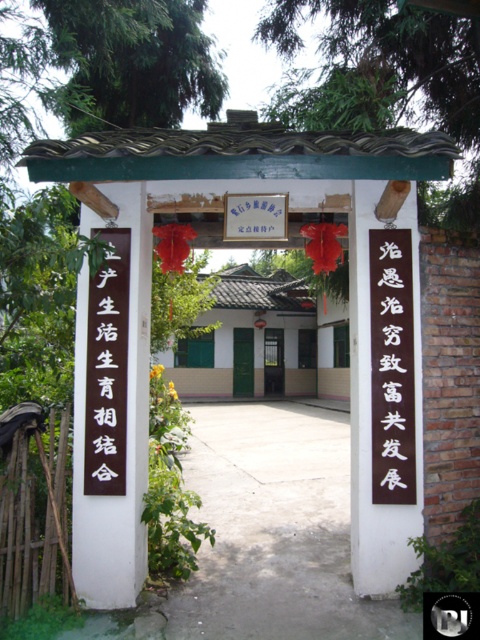
Who is higher up, brown wooden sign at center-right or metallic door at center?

brown wooden sign at center-right is above.

Measure the distance between brown wooden sign at center-right and camera.

brown wooden sign at center-right and camera are 3.43 meters apart from each other.

Find the location of a particular element. The image size is (480, 640). brown wooden sign at center-right is located at coordinates (384, 385).

Does green leafy tree at upper left have a greater width compared to black wood sign at center?

Yes.

At what (x,y) coordinates should I click in order to perform the action: click on green leafy tree at upper left. Please return your answer as a coordinate pair (x, y). Image resolution: width=480 pixels, height=640 pixels. Looking at the image, I should click on (132, 61).

You are a GUI agent. You are given a task and a screenshot of the screen. Output one action in this format:
    pyautogui.click(x=<x>, y=<y>)
    Task: Click on the green leafy tree at upper left
    
    Given the screenshot: What is the action you would take?
    pyautogui.click(x=132, y=61)

Is brown wooden sign at center-right positioned at the back of black paper at center?

That is False.

Is brown wooden sign at center-right below black paper at center?

Yes.

Which is in front, point (408, 256) or point (93, 432)?

Point (93, 432) is in front.

This screenshot has width=480, height=640. In order to click on brown wooden sign at center-right in this screenshot , I will do `click(384, 385)`.